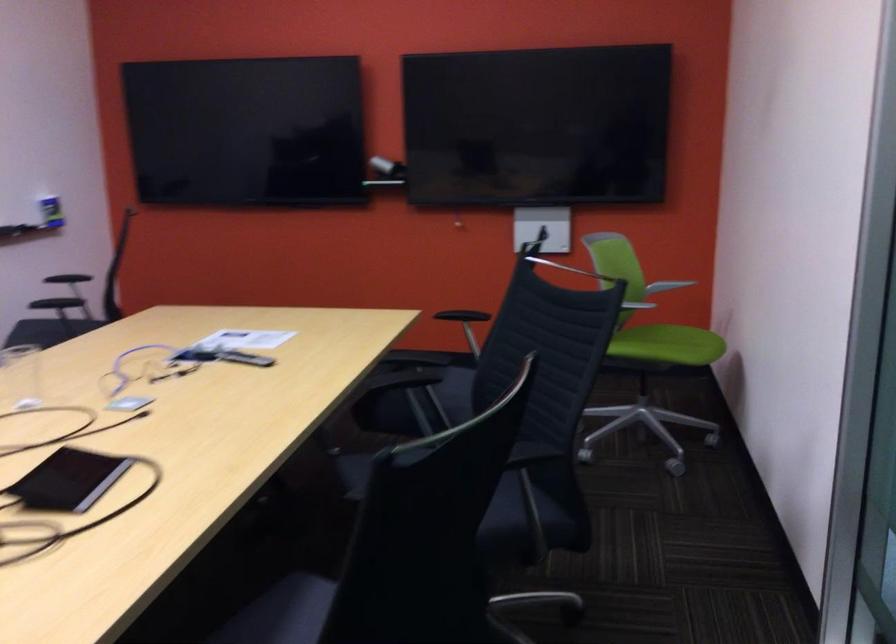
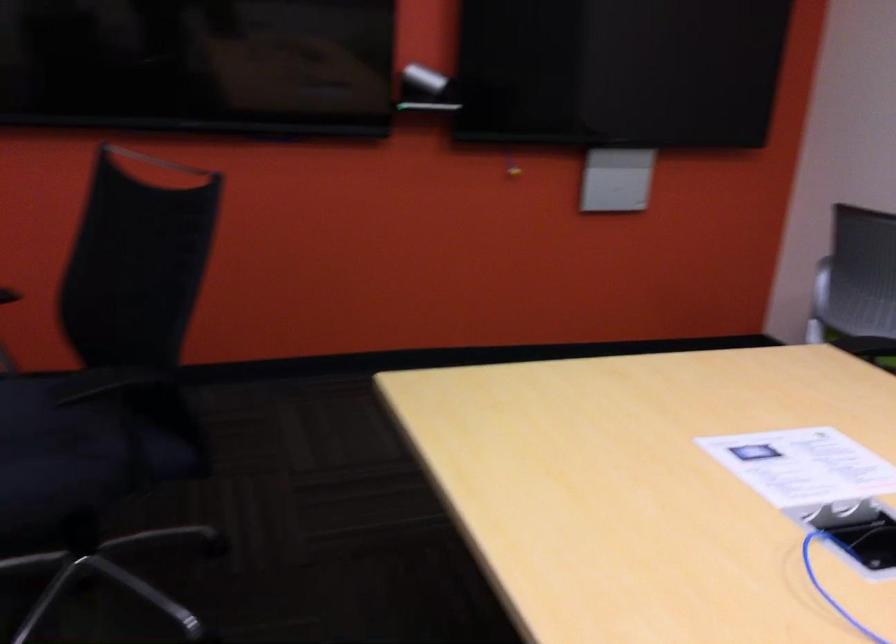
Find the pixel in the second image that matches (x=268, y=337) in the first image.

(803, 466)